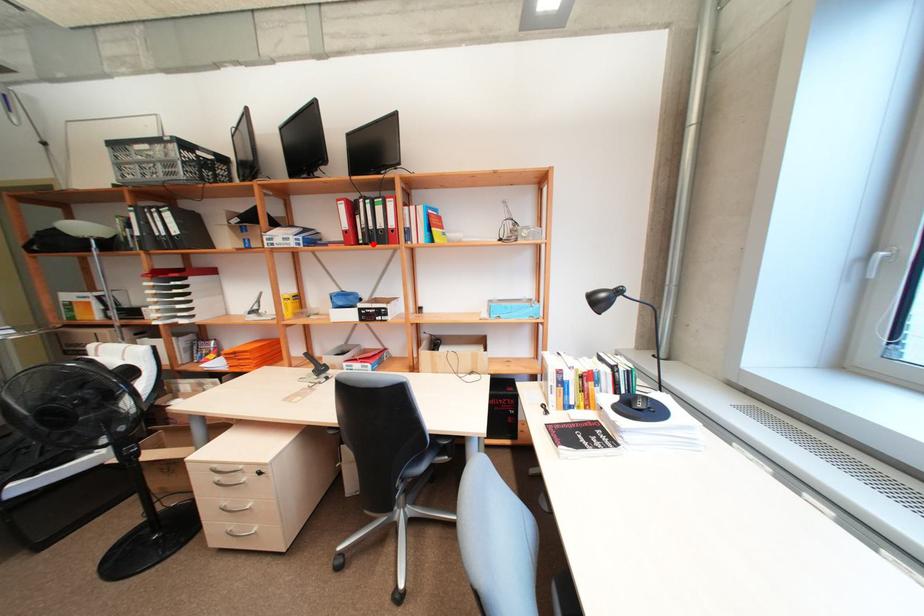
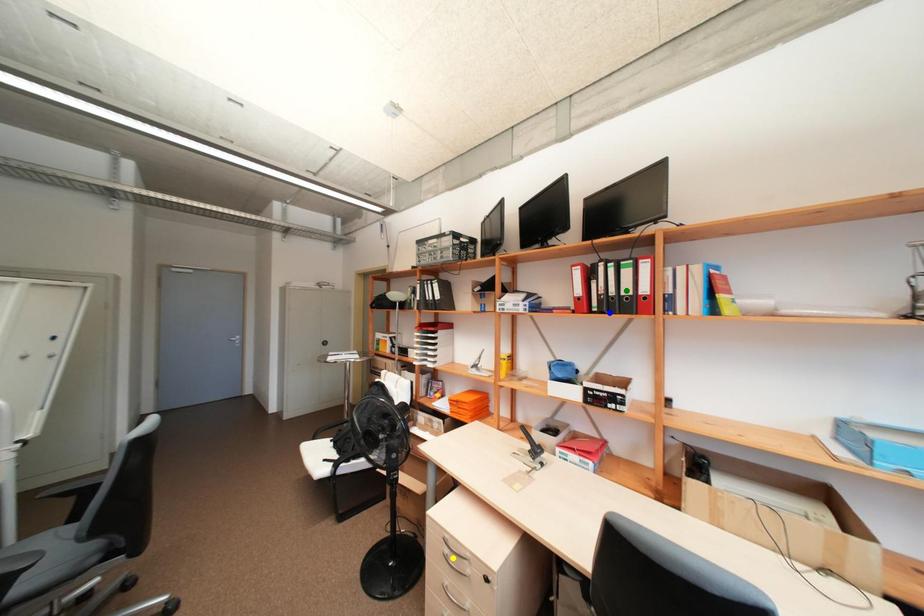
Question: I am providing you with two images of the same scene from different viewpoints. A red point is marked on the first image. You are given multiple points on the second image. Which point in image 2 is actually the same real-world point as the red point in image 1?

Choices:
 (A) blue point
 (B) green point
 (C) yellow point

Answer: (A)